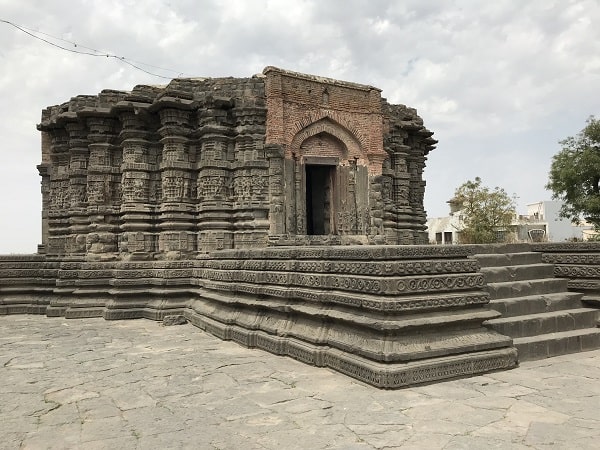
Image resolution: width=600 pixels, height=450 pixels. Find the location of `doorway`. doorway is located at coordinates (321, 207).